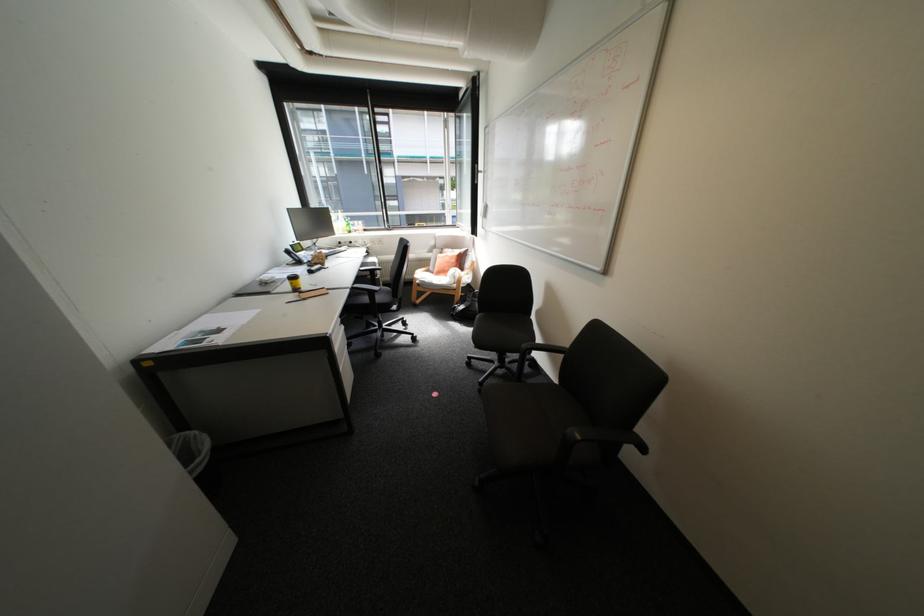
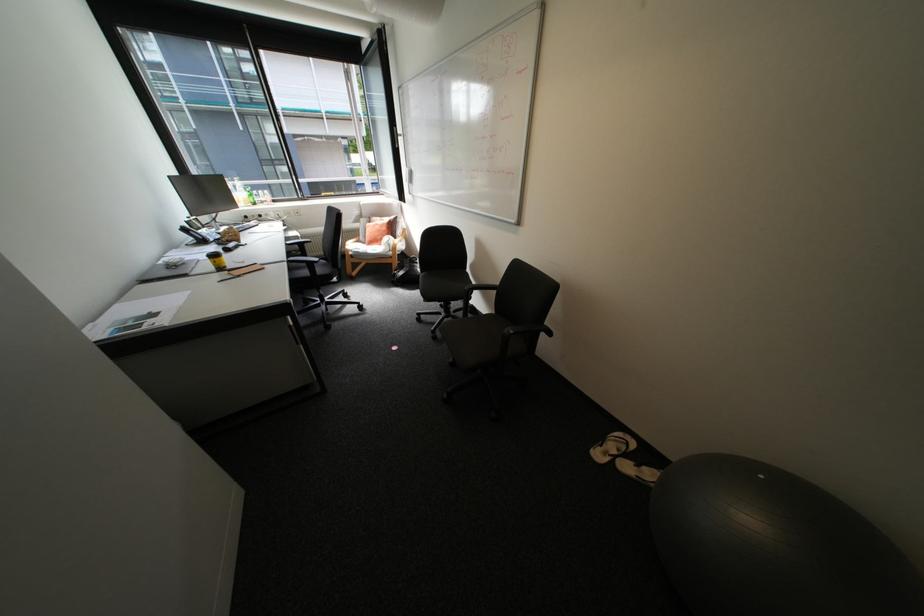
Where in the second image is the point corresponding to [491,384] from the first image?

(444, 331)